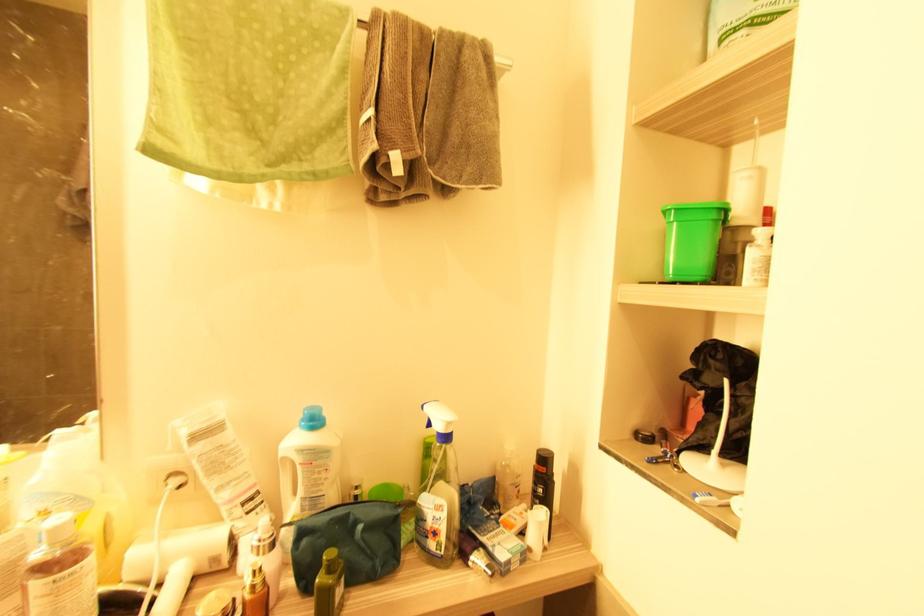
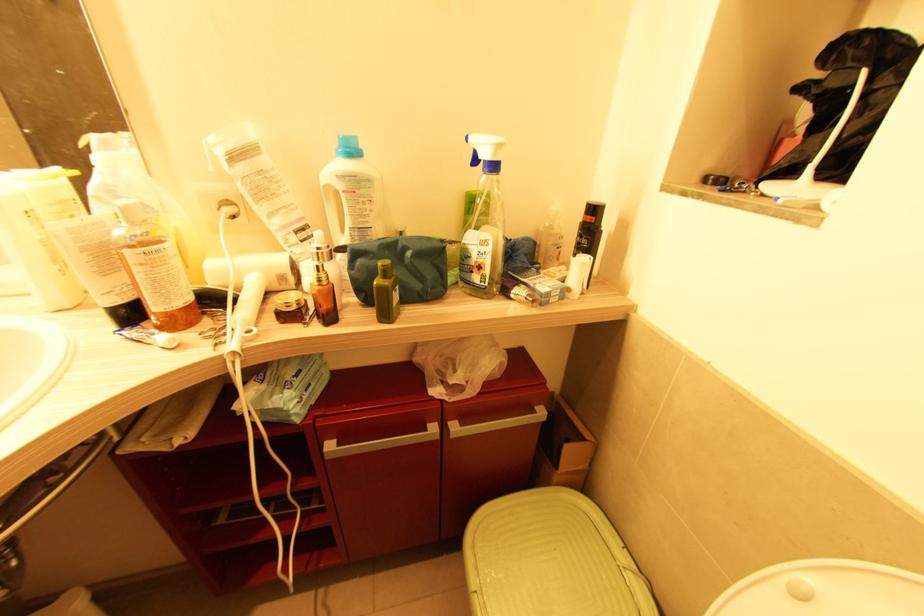
Find the pixel in the second image that matches point (331, 572) in the first image.

(386, 278)